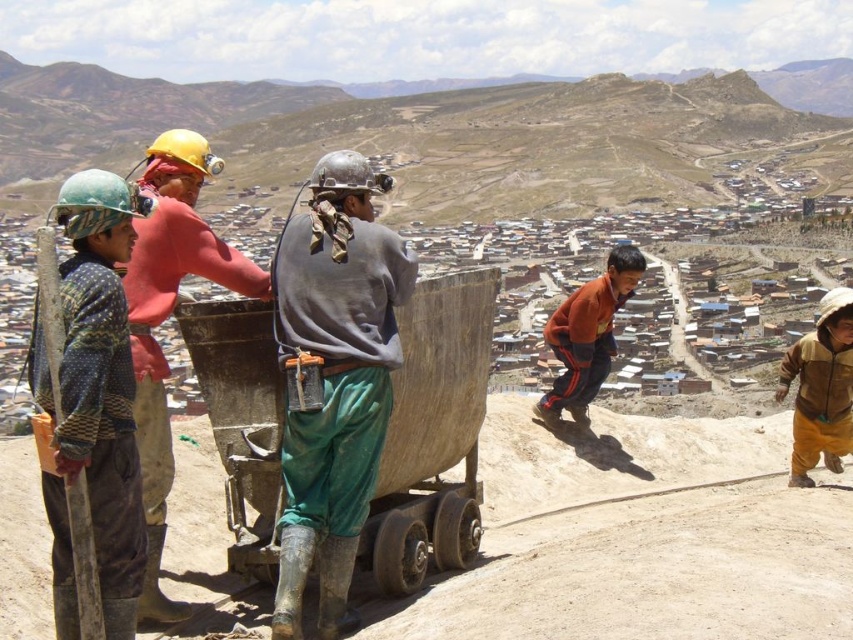
You are a safety inspector assessing the equipment in the image. The matte yellow hard hat at upper left and the brown fuzzy jacket at right are both present. Which object takes up more visual space in the image?

The brown fuzzy jacket at right takes up more visual space than the matte yellow hard hat at upper left.

You are a drone operator tasked with capturing aerial footage of the construction site. The matte yellow hard hat at upper left and the brown fuzzy jacket at right are two key points you need to film. Given that your drone has a maximum camera zoom range of 35 meters, can you capture both subjects in a single shot without moving the drone?

The matte yellow hard hat at upper left and brown fuzzy jacket at right are 40.00 meters apart, which exceeds the drone camera zoom range of 35 meters. Therefore, you cannot capture both subjects in a single shot without moving the drone.

You are a delivery robot that needs to deliver a package to the brown fuzzy jacket at right. You are currently at the position of the green fabric pants at center. Given that your maximum delivery range is 100 feet, will you be able to deliver the package without needing a recharge?

The distance between the green fabric pants at center and the brown fuzzy jacket at right is 106.15 feet, which exceeds the delivery robot maximum range of 100 feet. Therefore, the robot cannot deliver the package without needing a recharge.